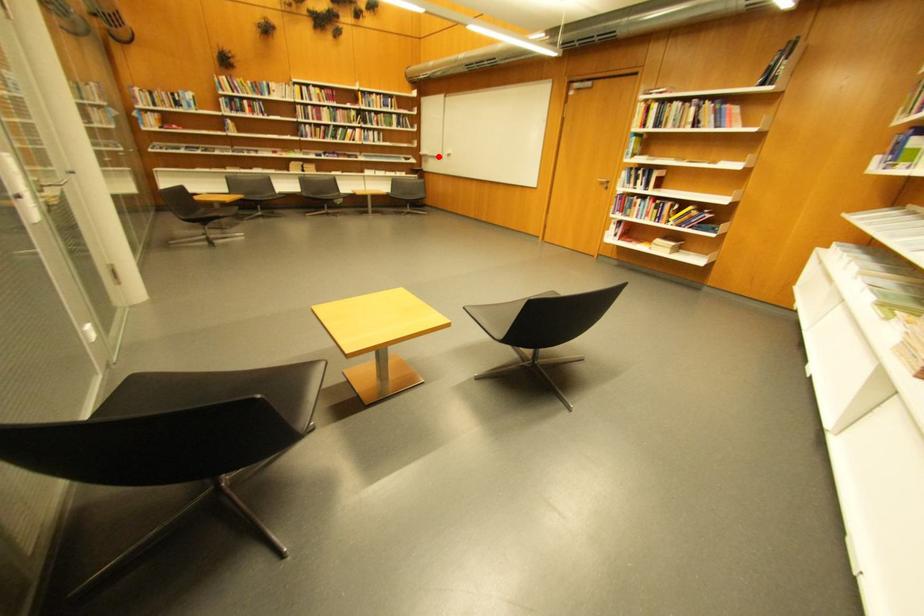
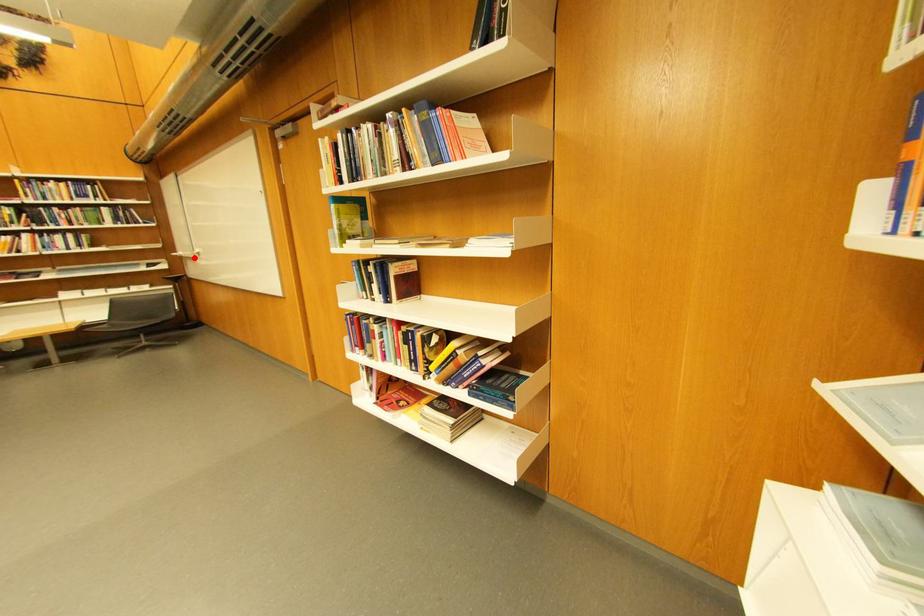
I am providing you with two images of the same scene from different viewpoints. A red point is marked on the first image and another point is marked on the second image. Does the point marked in image1 correspond to the same location as the one in image2?

Yes